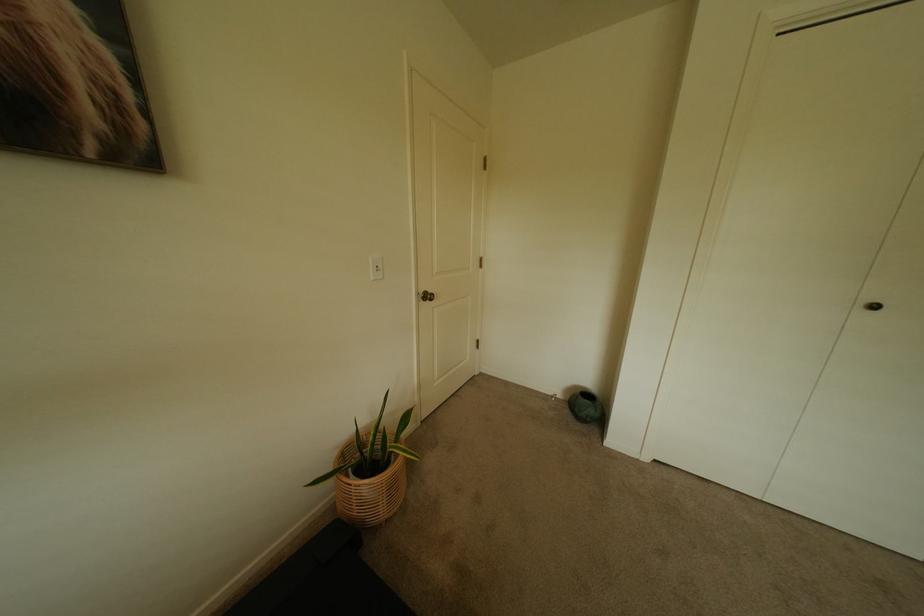
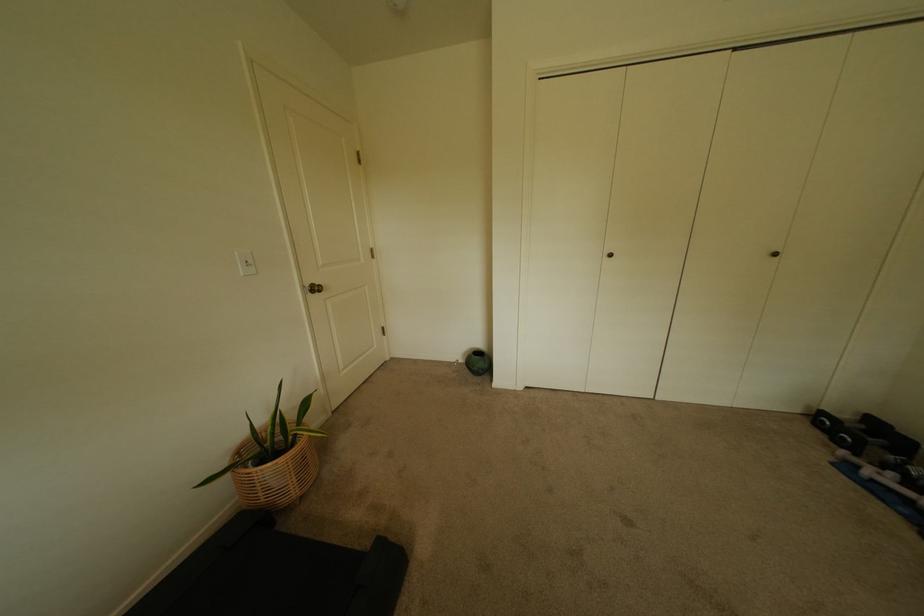
Find the pixel in the second image that matches the point at 882,308 in the first image.

(618, 256)